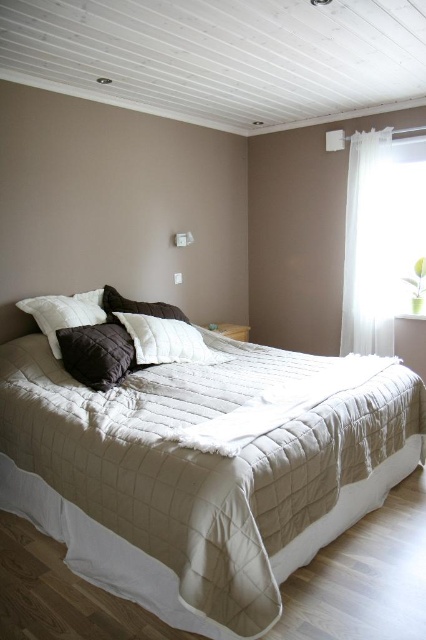
Is white quilted pillow at center smaller than white soft pillow at upper left?

Yes.

What are the coordinates of `white quilted pillow at center` in the screenshot? It's located at (166, 340).

Is point (138, 353) positioned after point (46, 323)?

No, it is in front of (46, 323).

Identify the location of white quilted pillow at center. Image resolution: width=426 pixels, height=640 pixels. (166, 340).

Is dark brown quilted pillow at center to the right of white soft pillow at upper left from the viewer's perspective?

Correct, you'll find dark brown quilted pillow at center to the right of white soft pillow at upper left.

Can you confirm if dark brown quilted pillow at center is positioned above white soft pillow at upper left?

No, dark brown quilted pillow at center is not above white soft pillow at upper left.

At what (x,y) coordinates should I click in order to perform the action: click on dark brown quilted pillow at center. Please return your answer as a coordinate pair (x, y). This screenshot has width=426, height=640. Looking at the image, I should click on (97, 353).

Where is `dark brown quilted pillow at center`? This screenshot has width=426, height=640. dark brown quilted pillow at center is located at coordinates (97, 353).

Who is higher up, white sheer curtain at upper right or white soft pillow at upper left?

white sheer curtain at upper right is above.

Which is more to the left, white sheer curtain at upper right or white soft pillow at upper left?

Positioned to the left is white soft pillow at upper left.

Who is more forward, (385, 282) or (91, 321)?

Point (91, 321) is more forward.

Locate an element on the screen. The width and height of the screenshot is (426, 640). white sheer curtain at upper right is located at coordinates point(368,248).